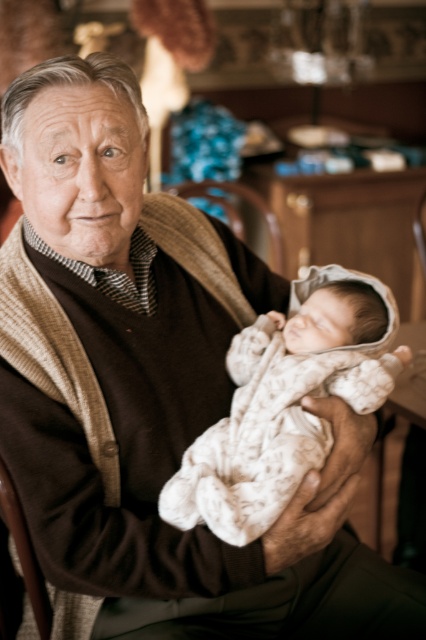
Question: Is white textured fabric at center positioned behind brown leather chair at center?

Choices:
 (A) no
 (B) yes

Answer: (A)

Question: Which of the following is the farthest from the observer?

Choices:
 (A) brown leather chair at center
 (B) white textured fabric at center

Answer: (A)

Question: Does white textured fabric at center appear over brown leather chair at center?

Choices:
 (A) no
 (B) yes

Answer: (A)

Question: Does white textured fabric at center appear on the left side of brown leather chair at center?

Choices:
 (A) yes
 (B) no

Answer: (B)